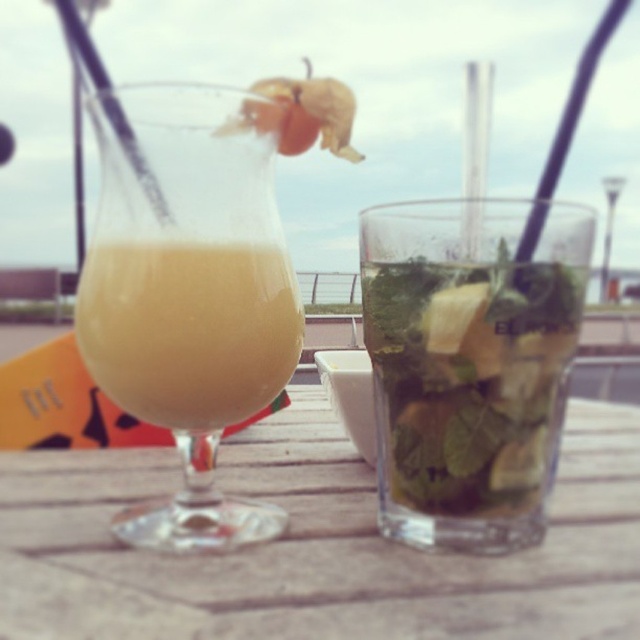
Question: Which object appears farthest from the camera in this image?

Choices:
 (A) translucent red physalis at upper center
 (B) wooden table at center

Answer: (A)

Question: Is the position of translucent glass drink at left less distant than that of green leafy liquid at center?

Choices:
 (A) no
 (B) yes

Answer: (A)

Question: Is wooden table at center bigger than translucent red physalis at upper center?

Choices:
 (A) no
 (B) yes

Answer: (B)

Question: Among these points, which one is nearest to the camera?

Choices:
 (A) (550, 428)
 (B) (352, 116)
 (C) (572, 486)

Answer: (A)

Question: Where is green leafy liquid at center located in relation to yellow translucent drink at left in the image?

Choices:
 (A) left
 (B) right

Answer: (B)

Question: Among these objects, which one is nearest to the camera?

Choices:
 (A) translucent glass drink at left
 (B) yellow translucent drink at left
 (C) green leafy liquid at center

Answer: (C)